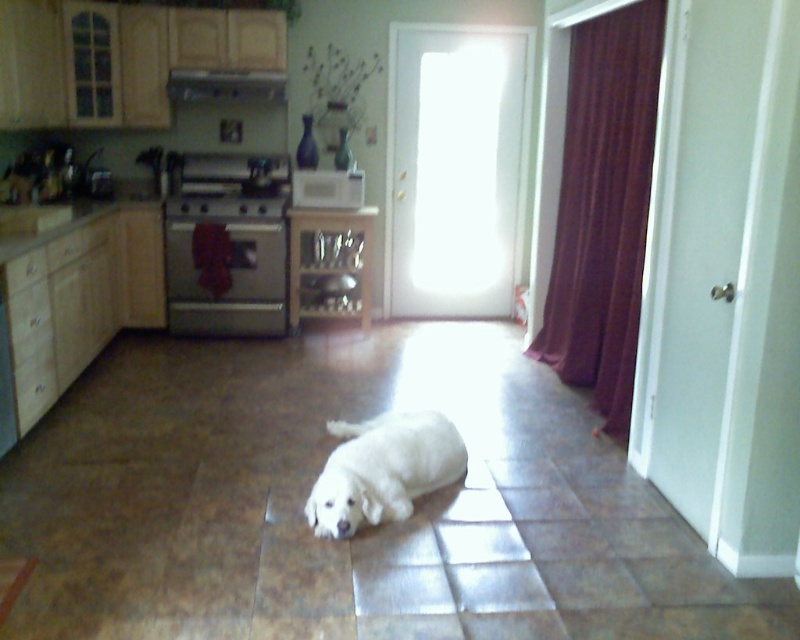
Can you confirm if brushed metal stove at center-left is smaller than white fur dog at center?

Yes, brushed metal stove at center-left is smaller than white fur dog at center.

Is point (200, 330) in front of point (401, 458)?

No, it is not.

Find the location of a particular element. This screenshot has height=640, width=800. brushed metal stove at center-left is located at coordinates (226, 244).